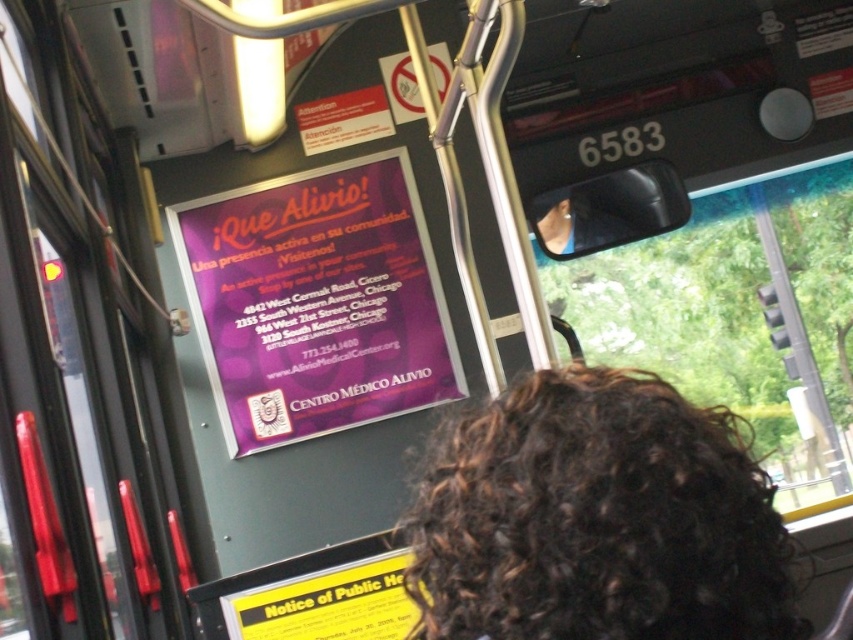
Can you confirm if purple glossy poster at upper center is shorter than yellow paper notice of public health at lower center?

Incorrect, purple glossy poster at upper center's height does not fall short of yellow paper notice of public health at lower center's.

Does point (309, 278) lie behind point (314, 624)?

That is True.

Identify the location of purple glossy poster at upper center. (316, 301).

Does dark curly hair at upper center appear on the right side of purple glossy poster at upper center?

Indeed, dark curly hair at upper center is positioned on the right side of purple glossy poster at upper center.

Does point (473, 552) come behind point (306, 330)?

That is False.

Identify the location of dark curly hair at upper center. Image resolution: width=853 pixels, height=640 pixels. (596, 518).

I want to click on dark curly hair at upper center, so click(x=596, y=518).

Does dark curly hair at upper center have a greater height compared to yellow paper notice of public health at lower center?

Correct, dark curly hair at upper center is much taller as yellow paper notice of public health at lower center.

Between point (511, 531) and point (318, 577), which one is positioned behind?

The point (318, 577) is more distant.

Find the location of a particular element. This screenshot has height=640, width=853. dark curly hair at upper center is located at coordinates (596, 518).